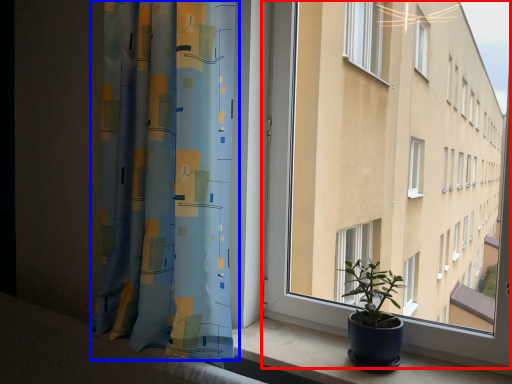
Question: Which of the following is the closest to the observer, window (highlighted by a red box) or curtain (highlighted by a blue box)?

Choices:
 (A) window
 (B) curtain

Answer: (A)